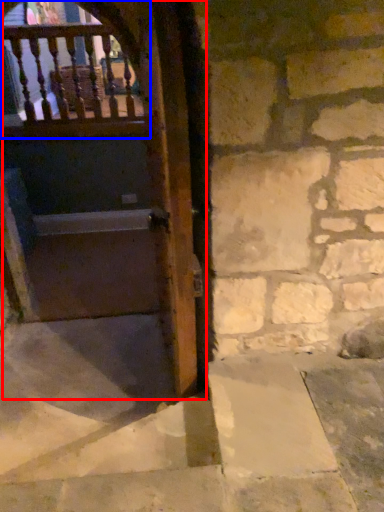
Question: Which point is closer to the camera, door (highlighted by a red box) or balcony (highlighted by a blue box)?

Choices:
 (A) door
 (B) balcony

Answer: (A)